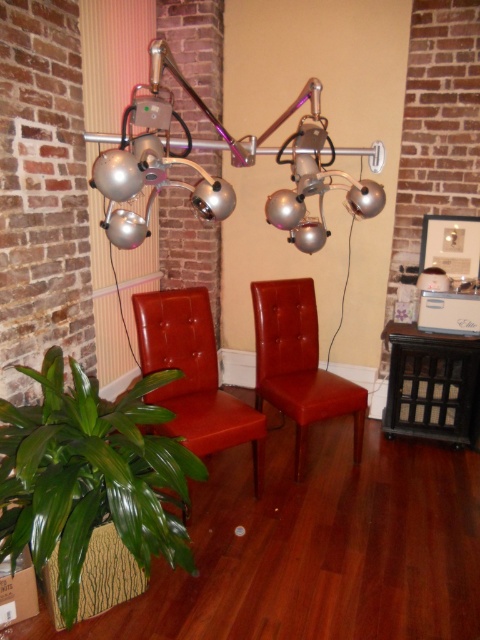
Question: Can you confirm if metallic silver lamp at upper center is smaller than leather at center?

Choices:
 (A) yes
 (B) no

Answer: (B)

Question: Which point is closer to the camera?

Choices:
 (A) (348, 403)
 (B) (132, 436)

Answer: (B)

Question: Does green leafy plant at lower left have a larger size compared to leather at left?

Choices:
 (A) yes
 (B) no

Answer: (A)

Question: Which of these objects is positioned closest to the leather at left?

Choices:
 (A) metallic silver lamp at upper center
 (B) leather at center

Answer: (B)

Question: From the image, what is the correct spatial relationship of green leafy plant at lower left in relation to metallic silver lamp at upper center?

Choices:
 (A) below
 (B) above

Answer: (A)

Question: Which object appears farthest from the camera in this image?

Choices:
 (A) metallic silver lamp at upper center
 (B) leather at left

Answer: (B)